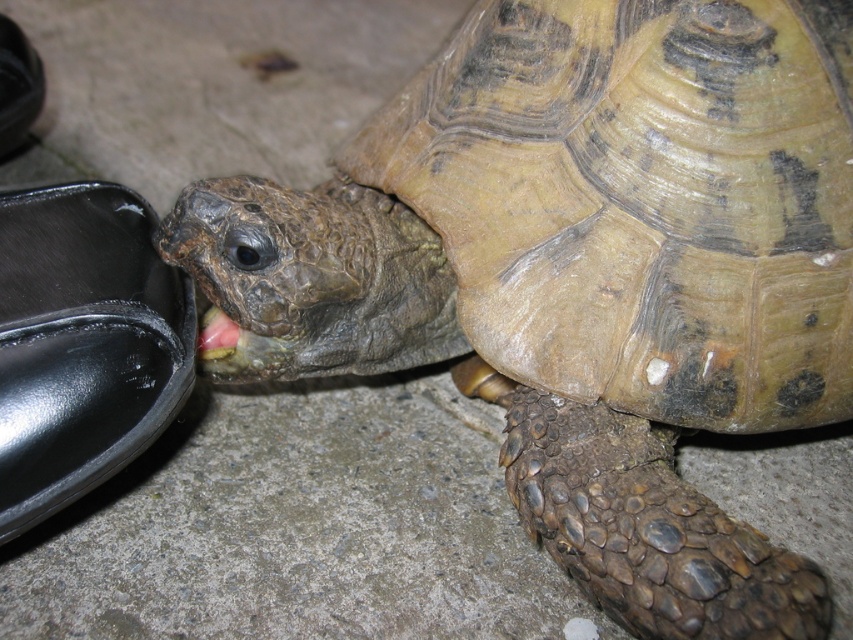
Is shiny black shoe at lower left further to camera compared to black leather shoe at left?

No, it is in front of black leather shoe at left.

Between shiny black shoe at lower left and black leather shoe at left, which one has less height?

black leather shoe at left

Does point (70, 381) come behind point (44, 86)?

No, (70, 381) is closer to viewer.

Where is `shiny black shoe at lower left`? The image size is (853, 640). shiny black shoe at lower left is located at coordinates (82, 342).